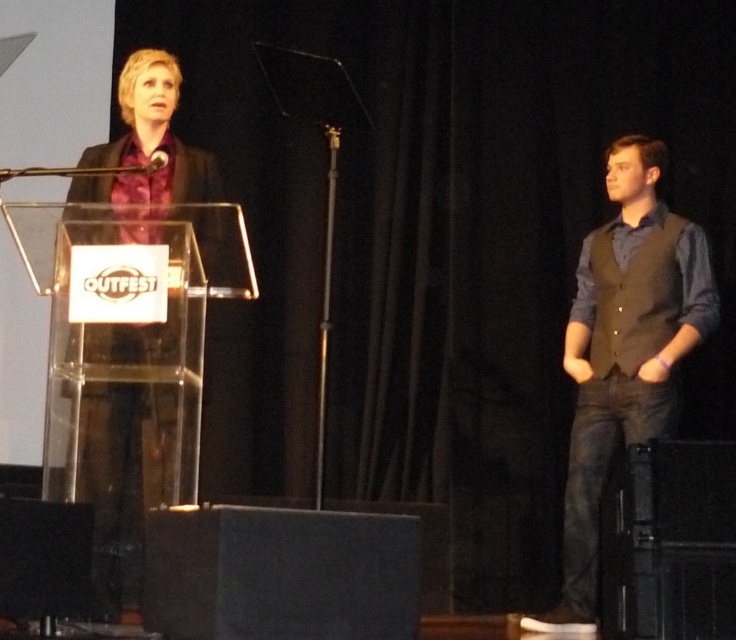
You are an event photographer positioned at the back of the stage. You want to capture a clear shot of both the dark gray vest at right and the metallic silver microphone at upper center. However, you notice that one of the objects is closer to you than the other. Which object is closer to your current position?

The dark gray vest at right is closer to you than the metallic silver microphone at upper center because it is further to the viewer, meaning it is positioned nearer to your location at the back of the stage.

You are an event coordinator who needs to adjust the microphone stand so that the metallic silver microphone at upper center is closer to the dark gray vest at right. Based on the current distance between them, how much closer should you move the microphone stand to ensure the distance becomes 3 feet?

The dark gray vest at right is currently 6.54 feet away from the metallic silver microphone at upper center. To reduce the distance to 3 feet, you should move the microphone stand closer by 3.54 feet.